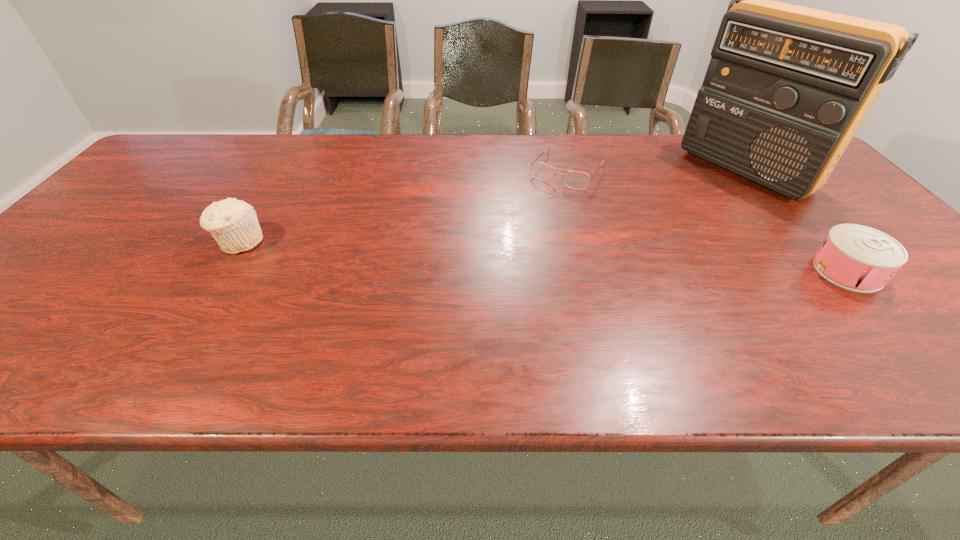
This screenshot has width=960, height=540. What are the coordinates of `free space on the desktop that is between the third shortest object and the can and is positioned on the front-facing side of the spectacles` in the screenshot? It's located at (509, 255).

At what (x,y) coordinates should I click in order to perform the action: click on free spot on the desktop that is between the muffin and the can and is positioned on the front-facing side of the tallest object. Please return your answer as a coordinate pair (x, y). Image resolution: width=960 pixels, height=540 pixels. Looking at the image, I should click on (592, 259).